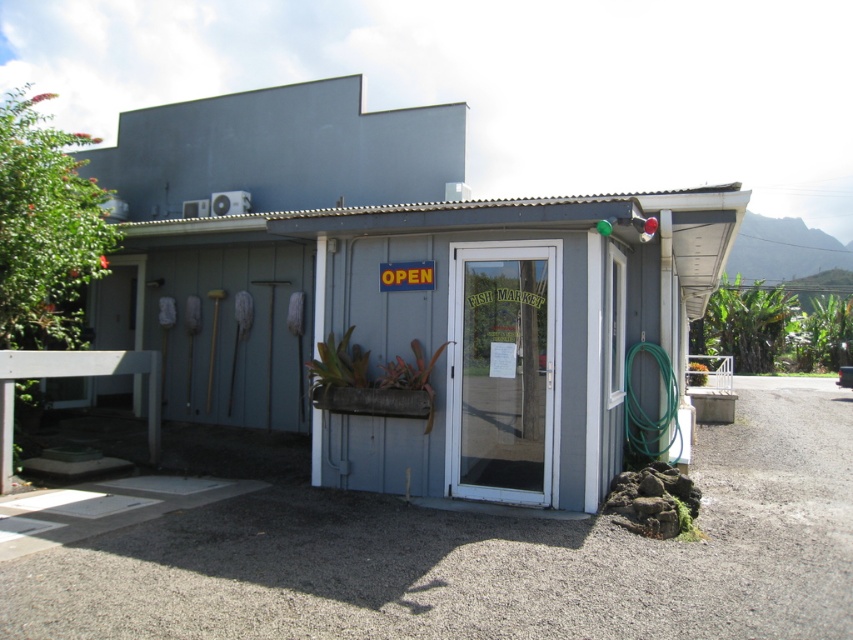
Question: Which is nearer to the matte gray hut at center?

Choices:
 (A) green rubber hose at right
 (B) transparent glass door at center

Answer: (B)

Question: Does matte gray hut at center come behind transparent glass door at center?

Choices:
 (A) yes
 (B) no

Answer: (B)

Question: Which point is farther from the camera taking this photo?

Choices:
 (A) (637, 435)
 (B) (198, 285)

Answer: (B)

Question: Can you confirm if transparent glass door at center is positioned above green rubber hose at right?

Choices:
 (A) yes
 (B) no

Answer: (A)

Question: Which point is closer to the camera taking this photo?

Choices:
 (A) (241, 364)
 (B) (666, 358)
 (C) (473, 296)

Answer: (C)

Question: From the image, what is the correct spatial relationship of matte gray hut at center in relation to green rubber hose at right?

Choices:
 (A) right
 (B) left

Answer: (B)